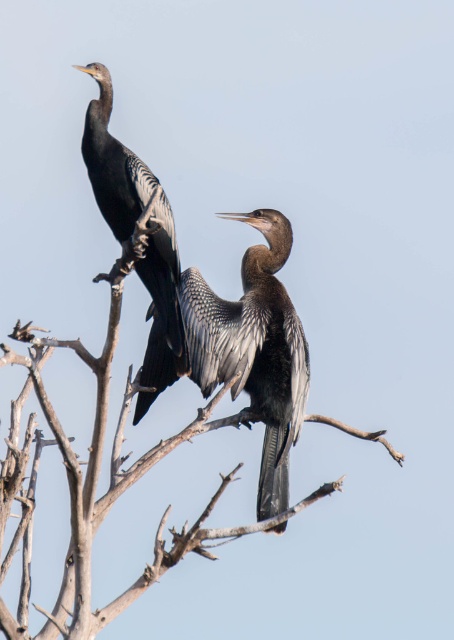
Between dark gray feathers at center and shiny black bird at left, which one appears on the right side from the viewer's perspective?

Positioned to the right is dark gray feathers at center.

Consider the image. Between dark gray feathers at center and shiny black bird at left, which one is positioned higher?

shiny black bird at left

Does point (299, 358) lie behind point (128, 156)?

Yes.

At what (x,y) coordinates should I click in order to perform the action: click on dark gray feathers at center. Please return your answer as a coordinate pair (x, y). Looking at the image, I should click on (253, 348).

Between brown wood tree at center and dark gray feathers at center, which one appears on the right side from the viewer's perspective?

dark gray feathers at center

Where is `brown wood tree at center`? The image size is (454, 640). brown wood tree at center is located at coordinates (178, 432).

Measure the distance between point (271,275) and camera.

18.56 meters

The image size is (454, 640). What do you see at coordinates (178, 432) in the screenshot?
I see `brown wood tree at center` at bounding box center [178, 432].

What do you see at coordinates (178, 432) in the screenshot?
I see `brown wood tree at center` at bounding box center [178, 432].

Identify the location of brown wood tree at center. (178, 432).